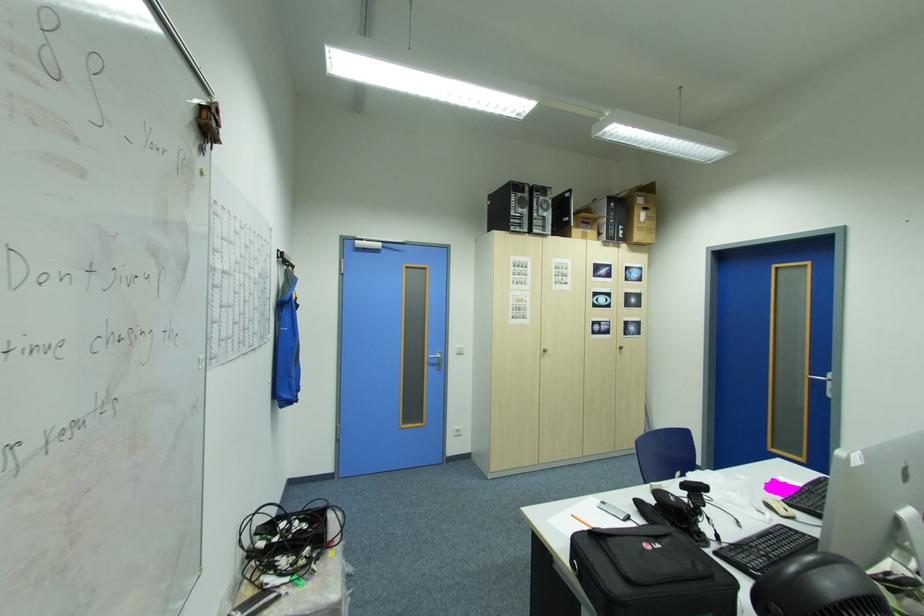
Where would you lift the black phone handset? Please return your answer as a coordinate pair (x, y).

(681, 509)